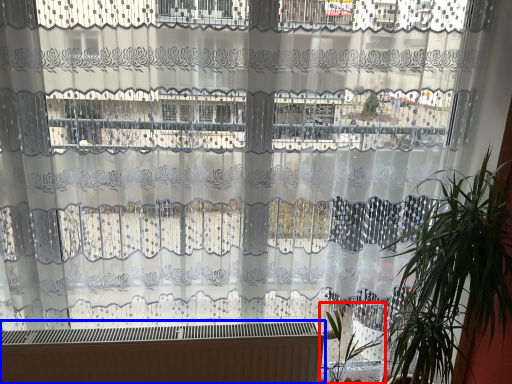
Question: Which object is closer to the camera taking this photo, vegetation (highlighted by a red box) or heater (highlighted by a blue box)?

Choices:
 (A) vegetation
 (B) heater

Answer: (A)